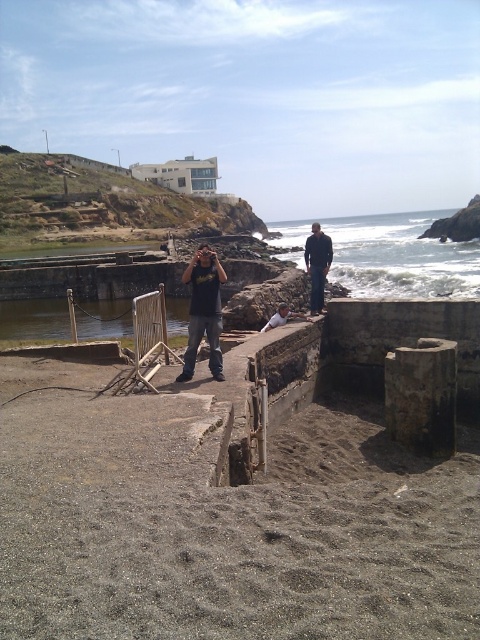
Find the location of a particular element. This screenshot has width=480, height=640. gray gravel at center is located at coordinates (222, 522).

Can you confirm if gray gravel at center is shorter than dark blue jeans at center?

Correct, gray gravel at center is not as tall as dark blue jeans at center.

Is point (327, 532) closer to viewer compared to point (312, 227)?

Yes, point (327, 532) is closer to viewer.

This screenshot has height=640, width=480. Find the location of `gray gravel at center`. gray gravel at center is located at coordinates (222, 522).

Is point (332, 220) positioned before point (311, 273)?

That is False.

Can you confirm if blue ocean water at center is wider than dark blue jeans at center?

Yes, blue ocean water at center is wider than dark blue jeans at center.

What do you see at coordinates (400, 257) in the screenshot? I see `blue ocean water at center` at bounding box center [400, 257].

At what (x,y) coordinates should I click in order to perform the action: click on blue ocean water at center. Please return your answer as a coordinate pair (x, y). This screenshot has height=640, width=480. Looking at the image, I should click on (400, 257).

Does blue ocean water at center have a greater height compared to matte black t-shirt at center?

Yes.

Does blue ocean water at center come behind matte black t-shirt at center?

Yes, it is.

Where is `blue ocean water at center`? blue ocean water at center is located at coordinates (400, 257).

The image size is (480, 640). What are the coordinates of `blue ocean water at center` in the screenshot? It's located at (400, 257).